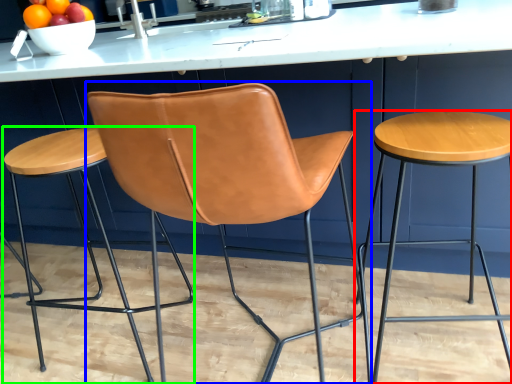
Question: Estimate the real-world distances between objects in this image. Which object is closer to stool (highlighted by a red box), chair (highlighted by a blue box) or stool (highlighted by a green box)?

Choices:
 (A) chair
 (B) stool

Answer: (A)